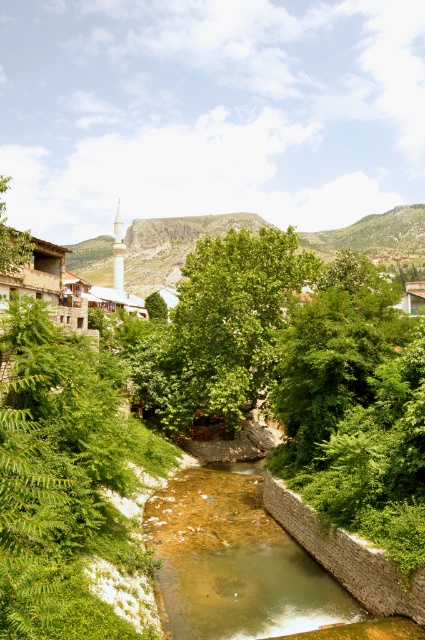
Looking at this image, can you confirm if brown/rocky water at center is smaller than green leafy tree at upper left?

Yes, brown/rocky water at center is smaller than green leafy tree at upper left.

Does brown/rocky water at center appear on the left side of green leafy tree at upper left?

In fact, brown/rocky water at center is to the right of green leafy tree at upper left.

Between point (217, 497) and point (5, 186), which one is positioned in front?

Point (5, 186)

Where is `brown/rocky water at center`? This screenshot has width=425, height=640. brown/rocky water at center is located at coordinates (234, 561).

Is point (241, 596) positioned after point (167, 349)?

No.

Between brown/rocky water at center and green leafy tree at center, which one appears on the left side from the viewer's perspective?

brown/rocky water at center

Is point (181, 586) farther from viewer compared to point (169, 429)?

No, it is in front of (169, 429).

The image size is (425, 640). What are the coordinates of `brown/rocky water at center` in the screenshot? It's located at (234, 561).

Looking at this image, between green leafy tree at center and green leafy tree at upper left, which one is positioned higher?

Positioned higher is green leafy tree at upper left.

Between green leafy tree at center and green leafy tree at upper left, which one has less height?

With less height is green leafy tree at center.

Who is more distant from viewer, (232, 230) or (3, 237)?

Positioned behind is point (232, 230).

The height and width of the screenshot is (640, 425). What are the coordinates of `green leafy tree at center` in the screenshot? It's located at (229, 324).